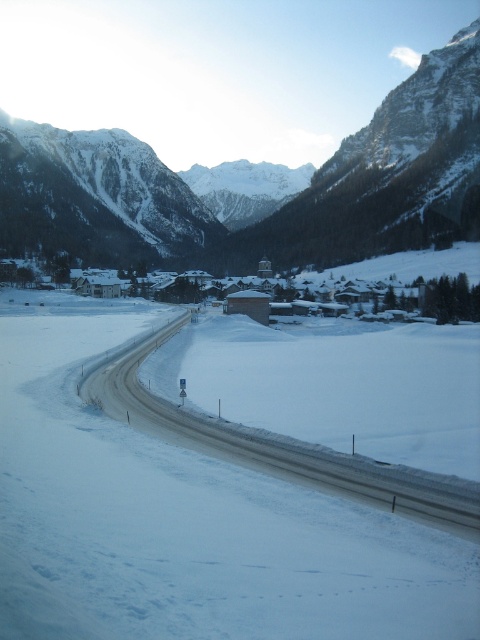
You are standing at the bottom of the valley looking up towards the snowy granite mountain range at upper center. Which direction should you face to have the mountain range in your line of sight?

You should face upwards since the snowy granite mountain range at upper center is located at point [259,205], which is in the upper part of the scene.

You are a driver planning to take a photo of the snowy granite mountain range at upper center and the white asphalt highway at center from the road. Which object will appear wider in the photo?

The snowy granite mountain range at upper center will appear wider in the photo because its width surpasses that of the white asphalt highway at center.